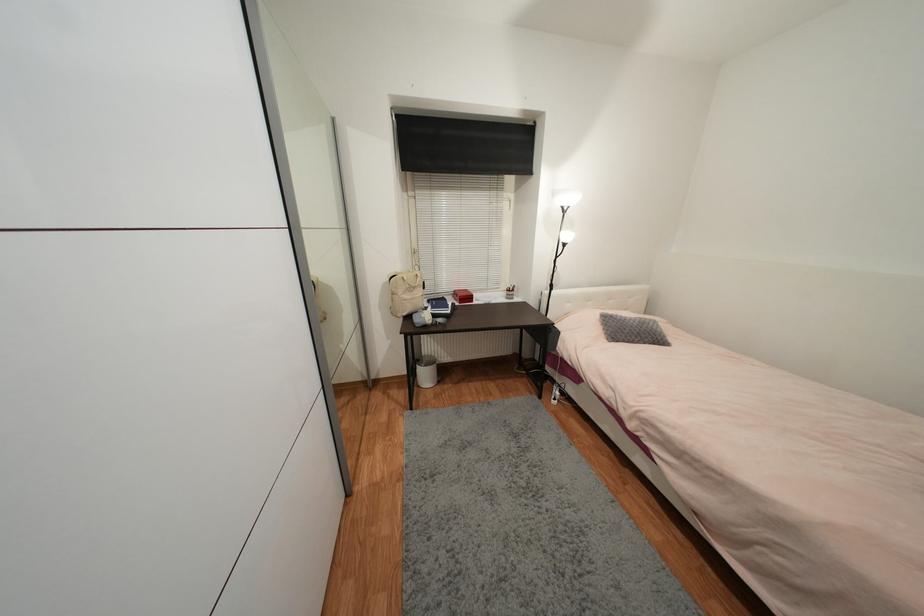
In order to click on red box in this screenshot , I will do `click(463, 296)`.